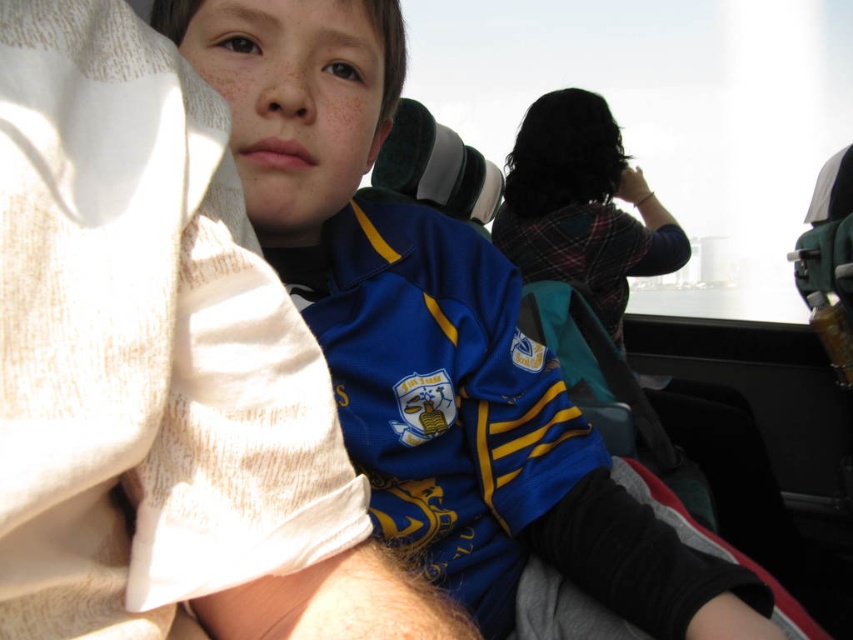
Question: Which of the following is the farthest from the observer?

Choices:
 (A) blue jersey at upper left
 (B) blue jersey at center

Answer: (B)

Question: Can you confirm if blue jersey at upper left is bigger than blue jersey at center?

Choices:
 (A) no
 (B) yes

Answer: (A)

Question: Is blue jersey at upper left above blue jersey at center?

Choices:
 (A) no
 (B) yes

Answer: (A)

Question: Which point is closer to the camera?

Choices:
 (A) blue jersey at center
 (B) blue jersey at upper left

Answer: (B)

Question: Can you confirm if blue jersey at upper left is thinner than blue jersey at center?

Choices:
 (A) no
 (B) yes

Answer: (B)